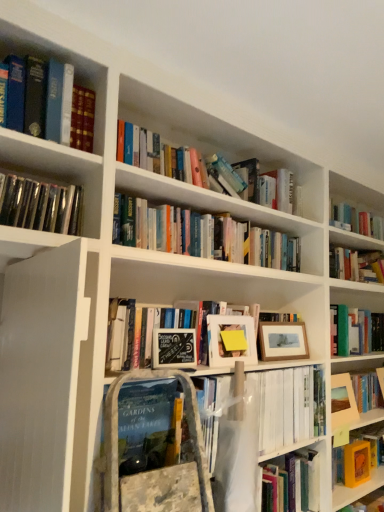
Question: Is hardcover book at center, which is the 1th book from bottom to top, taller or shorter than black chalkboard sign at center, which is the 2th paperback book in bottom-to-top order?

Choices:
 (A) short
 (B) tall

Answer: (B)

Question: In the image, is hardcover book at center, positioned as the third book in top-to-bottom order, on the left side or the right side of black chalkboard sign at center, which is the second paperback book in right-to-left order?

Choices:
 (A) right
 (B) left

Answer: (B)

Question: Estimate the real-world distances between objects in this image. Which object is closer to the matte white picture frame at center, which is counted as the 1th picture frame, starting from the left?

Choices:
 (A) hardcover books at upper left, acting as the 3th book starting from the bottom
 (B) black chalkboard sign at center, which is the 2th paperback book in bottom-to-top order
 (C) matte wooden picture frame at right, which appears as the 1th picture frame when ordered from the bottom
 (D) wooden picture frame at center-right, which appears as the second picture frame when ordered from the bottom
 (E) hardcover book at center, which is the 1th book from bottom to top

Answer: (B)

Question: Which object is positioned closest to the matte wooden picture frame at right, acting as the 1th picture frame starting from the right?

Choices:
 (A) hardcover books at upper left, positioned as the 1th book in top-to-bottom order
 (B) yellow matte book at lower right, the 1th paperback book positioned from the back
 (C) hardcover book at center, positioned as the third book in top-to-bottom order
 (D) shiny black vinyl records at upper left, which is the 2th book from bottom to top
 (E) matte white picture frame at center, which appears as the 3th picture frame when viewed from the back

Answer: (B)